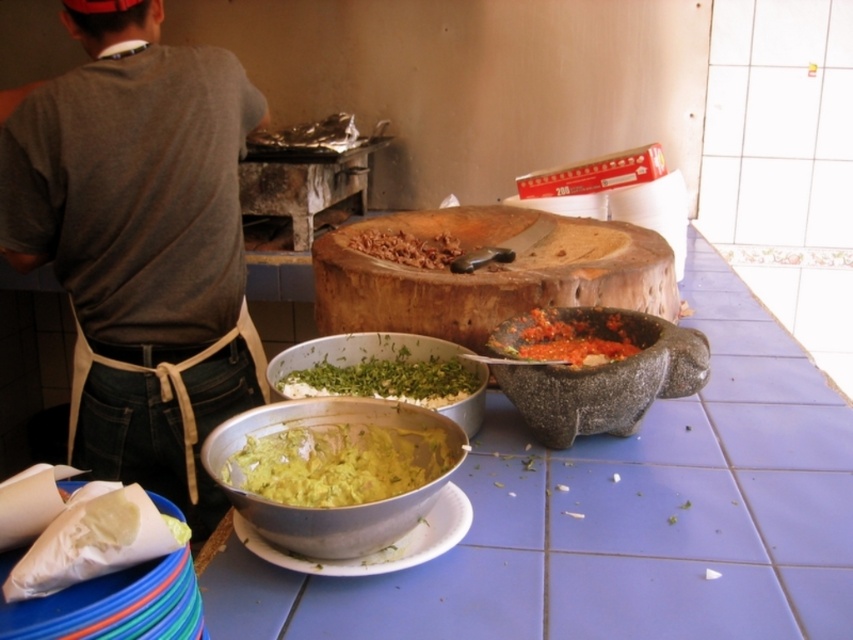
You are trying to place a 12 inch ruler between the gray stone mortar at center and the nearest bowl. Will it fit?

The distance between the gray stone mortar at center and the nearest bowl is 35.27 inches. Since the ruler is only 12 inches long, there is sufficient space to place it between them.

Consider the image. You are preparing to place a new bowl between the gray stone mortar at center and the white paper cone at lower left. Considering their sizes, which object should you place the bowl closer to?

The gray stone mortar at center has a larger width than the white paper cone at lower left, so you should place the bowl closer to the white paper cone at lower left to ensure there is enough space.

You are organizing a kitchen layout and need to place a new spice rack. You see the blue tile table at center and the brown cotton shirt at upper left. Which object should you place the spice rack to the left of to align with the existing setup?

The blue tile table at center is to the right of the brown cotton shirt at upper left, so you should place the spice rack to the left of the brown cotton shirt at upper left to maintain alignment with the existing setup.